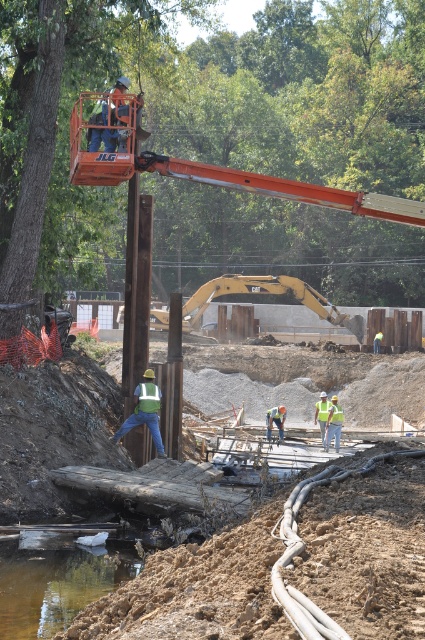
Where is `brown wooden plank at center`? The height and width of the screenshot is (640, 425). brown wooden plank at center is located at coordinates (365, 545).

Is point (402, 368) positioned after point (139, 406)?

That is True.

Is point (243, 552) farther from camera compared to point (153, 392)?

No, (243, 552) is in front of (153, 392).

At what (x,y) coordinates should I click in order to perform the action: click on brown wooden plank at center. Please return your answer as a coordinate pair (x, y). This screenshot has width=425, height=640. Looking at the image, I should click on (365, 545).

Can you confirm if green reflective safety vest at lower center is positioned above green reflective safety vest at center?

Yes.

Between point (158, 397) and point (328, 401), which one is positioned behind?

The point (328, 401) is more distant.

Which is in front, point (141, 390) or point (326, 410)?

Point (141, 390) is more forward.

Find the location of a particular element. green reflective safety vest at lower center is located at coordinates (x=147, y=397).

Is brown wooden plank at center above green reflective safety vest at center?

No.

The image size is (425, 640). Identify the location of brown wooden plank at center. (365, 545).

Find the location of a particular element. The width and height of the screenshot is (425, 640). brown wooden plank at center is located at coordinates (365, 545).